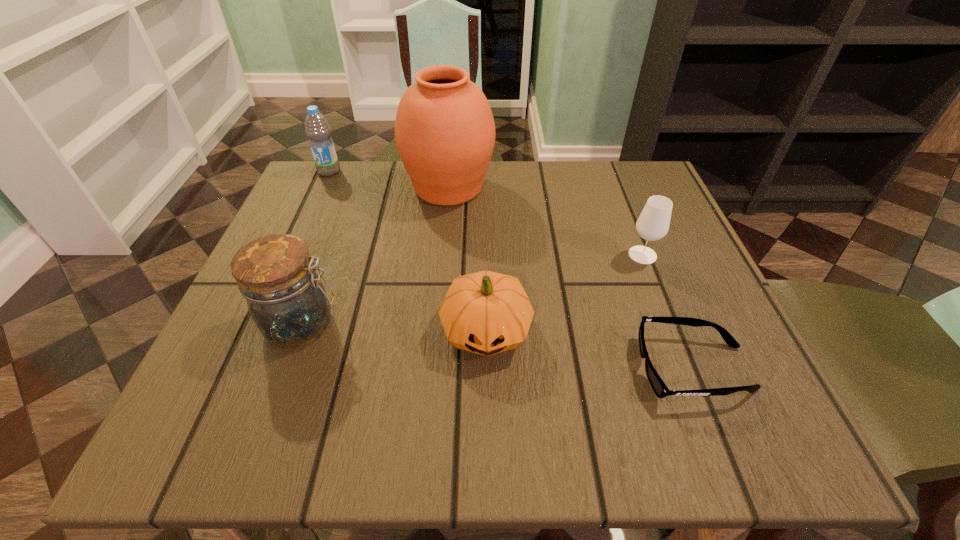
The image size is (960, 540). Find the location of `free point between the tallest object and the jar`. free point between the tallest object and the jar is located at coordinates (375, 256).

Locate an element on the screen. free space between the tallest object and the glass is located at coordinates (545, 221).

You are a GUI agent. You are given a task and a screenshot of the screen. Output one action in this format:
    pyautogui.click(x=<x>, y=<y>)
    Task: Click on the free space between the gourd and the fourth nearest object
    This screenshot has height=540, width=960.
    Given the screenshot: What is the action you would take?
    tap(564, 293)

This screenshot has height=540, width=960. Find the location of `vacant point located between the shortest object and the fourth nearest object`. vacant point located between the shortest object and the fourth nearest object is located at coordinates (668, 312).

What are the coordinates of `unoccupied position between the sunglasses and the tallest object` in the screenshot? It's located at (571, 278).

Locate an element on the screen. free space between the jar and the gourd is located at coordinates (395, 327).

In order to click on free spot between the gourd and the fourth nearest object in this screenshot , I will do `click(564, 293)`.

Locate an element on the screen. This screenshot has width=960, height=540. free space between the fourth nearest object and the water bottle is located at coordinates (486, 213).

Image resolution: width=960 pixels, height=540 pixels. What are the coordinates of `object that is the fifth closest to the gourd` in the screenshot? It's located at (317, 129).

Choose which object is the fifth nearest neighbor to the urn. Please provide its 2D coordinates. Your answer should be formatted as a tuple, i.e. [(x, y)], where the tuple contains the x and y coordinates of a point satisfying the conditions above.

[(660, 389)]